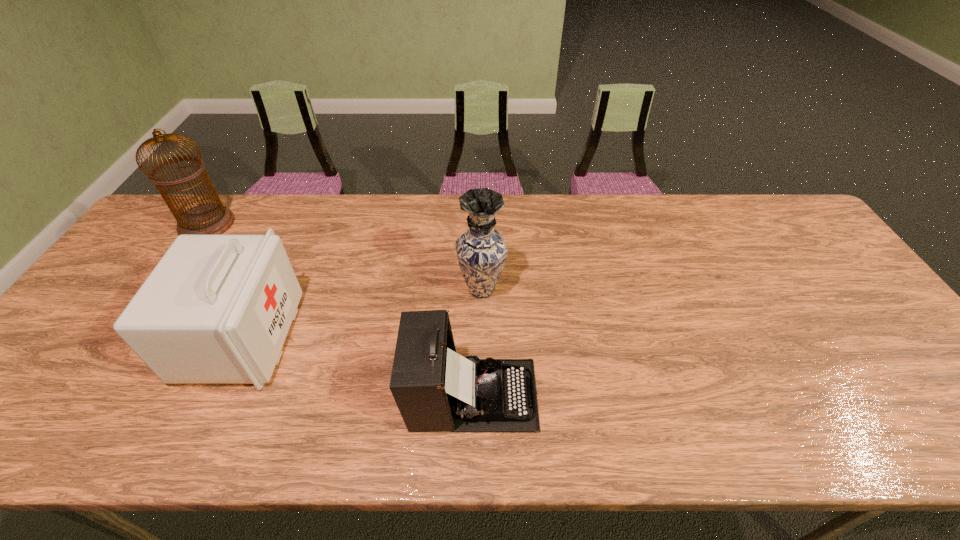
Locate an element on the screen. Image resolution: width=960 pixels, height=540 pixels. vacant space that satisfies the following two spatial constraints: 1. on the front-facing side of the vase; 2. on the left side of the farthest object is located at coordinates (163, 289).

Image resolution: width=960 pixels, height=540 pixels. Identify the location of free space that satisfies the following two spatial constraints: 1. on the front side of the vase; 2. inside the open case of the typewriter. (482, 395).